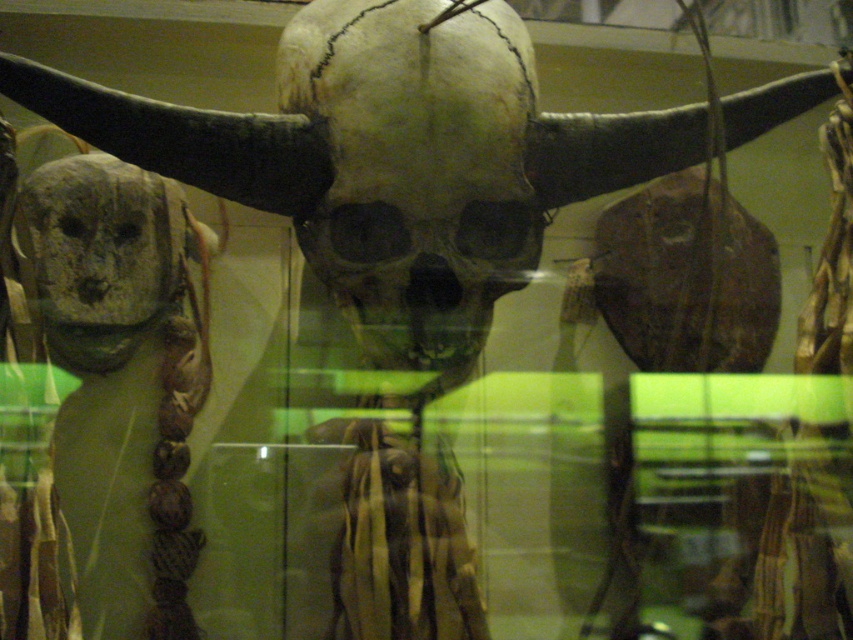
Which of these two, matte white skull at center or gray stone skull at left, stands taller?

matte white skull at center is taller.

Locate an element on the screen. matte white skull at center is located at coordinates (416, 168).

This screenshot has width=853, height=640. What do you see at coordinates (416, 168) in the screenshot?
I see `matte white skull at center` at bounding box center [416, 168].

Where is `matte white skull at center`? This screenshot has width=853, height=640. matte white skull at center is located at coordinates (416, 168).